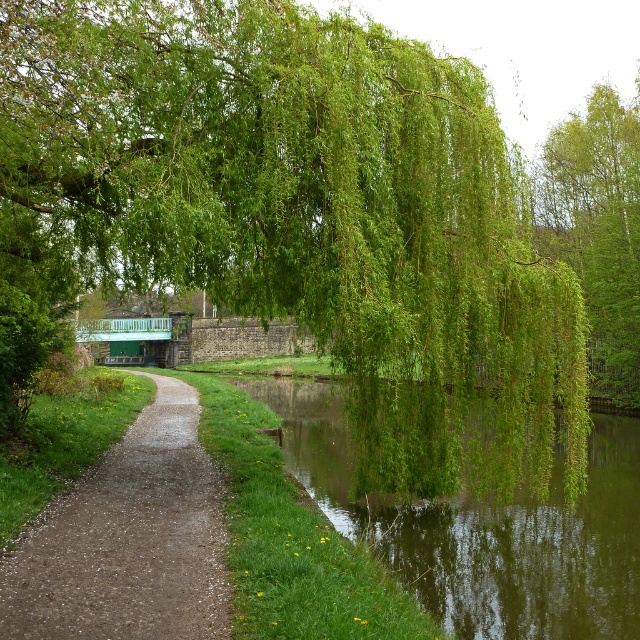
Question: Which is farther from the gravelly stone path at center?

Choices:
 (A) green leafy willow at upper center
 (B) green leafy river at center

Answer: (B)

Question: Does gravelly stone path at center have a smaller size compared to green leafy tree at upper right?

Choices:
 (A) yes
 (B) no

Answer: (A)

Question: Is gravelly stone path at center closer to camera compared to green leafy tree at upper right?

Choices:
 (A) yes
 (B) no

Answer: (A)

Question: Can you confirm if green leafy river at center is wider than green leafy tree at upper right?

Choices:
 (A) no
 (B) yes

Answer: (B)

Question: Which object is farther from the camera taking this photo?

Choices:
 (A) gravelly stone path at center
 (B) green leafy river at center

Answer: (B)

Question: Among these objects, which one is farthest from the camera?

Choices:
 (A) green leafy tree at upper right
 (B) green leafy willow at upper center

Answer: (A)